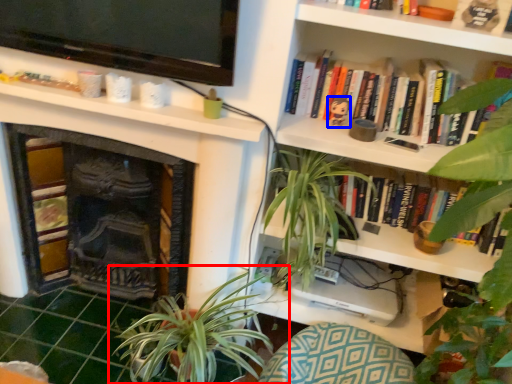
Question: Which point is closer to the camera, houseplant (highlighted by a red box) or toy (highlighted by a blue box)?

Choices:
 (A) houseplant
 (B) toy

Answer: (A)